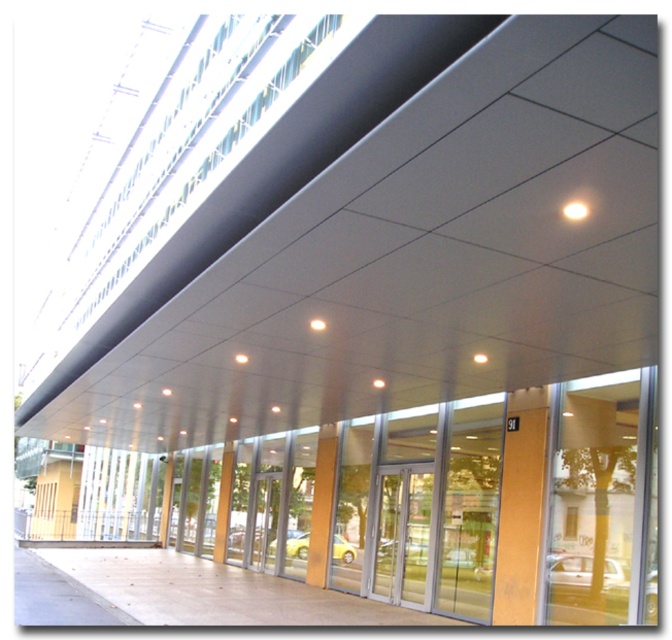
You are standing in front of the modern building and want to enter through the transparent glass door at center. Which direction should you move relative to the yellow matte pillar at center?

The transparent glass door at center is to the right of the yellow matte pillar at center, so you should move to the right side of the yellow matte pillar at center to reach the transparent glass door at center.

You are standing at the entrance of the modern building and want to locate the transparent glass door at center. According to the coordinates given, where would you find it?

The transparent glass door at center is located at the coordinates point (x=403, y=532).